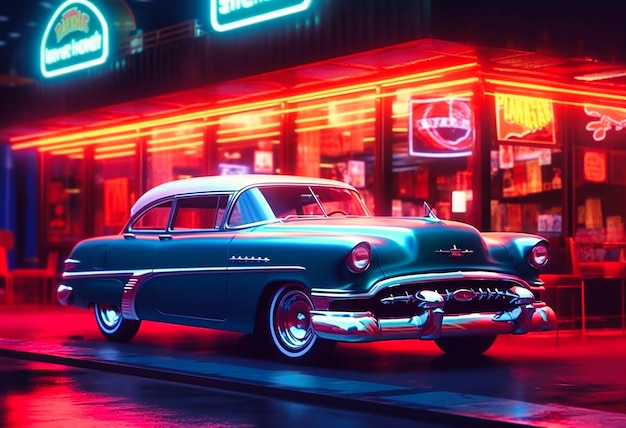
This screenshot has height=428, width=626. I want to click on blue neon sign, so click(x=103, y=32), click(x=215, y=23).